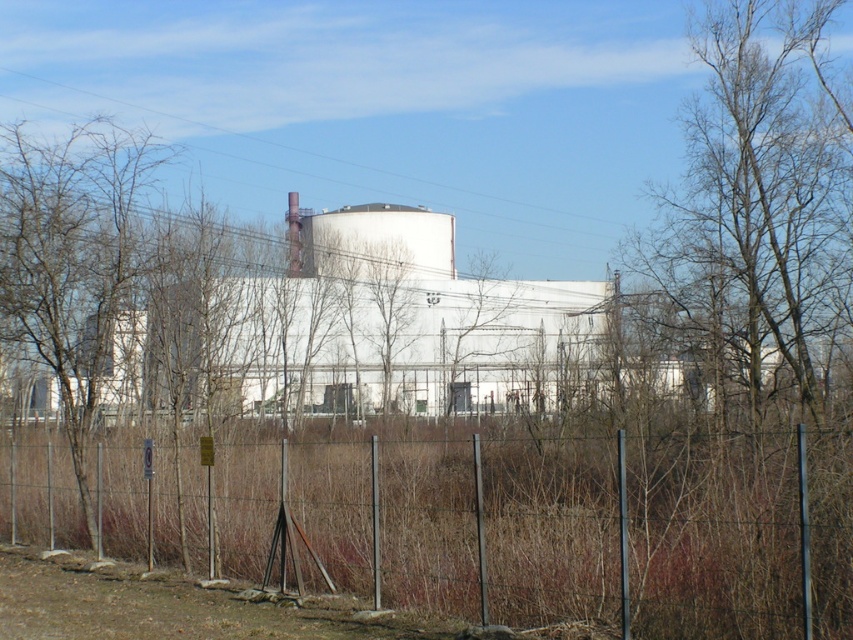
Question: Which object appears farthest from the camera in this image?

Choices:
 (A) metal wire fence at center
 (B) bare branches at center

Answer: (B)

Question: Which of these objects is positioned farthest from the bare branches at left?

Choices:
 (A) metal wire fence at center
 (B) bare branches at center

Answer: (B)

Question: Can you confirm if metal wire fence at center is positioned to the right of bare branches at left?

Choices:
 (A) no
 (B) yes

Answer: (B)

Question: Which point is closer to the camera?

Choices:
 (A) (234, 563)
 (B) (48, 337)
 (C) (795, 381)

Answer: (A)

Question: Is metal wire fence at center thinner than bare branches at left?

Choices:
 (A) yes
 (B) no

Answer: (B)

Question: Is metal wire fence at center above bare branches at center?

Choices:
 (A) no
 (B) yes

Answer: (A)